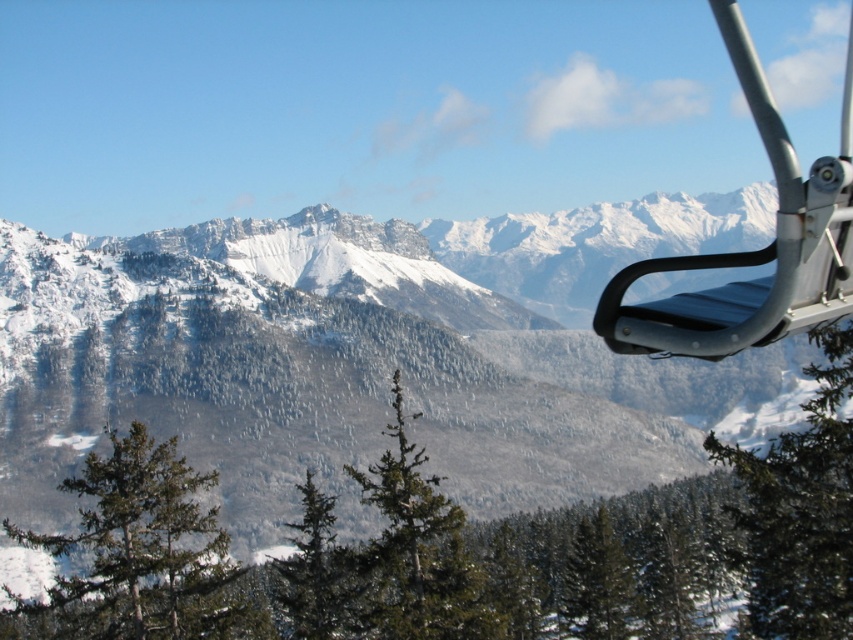
Identify the location of green matte tree at lower left. (136, 552).

Does green matte tree at lower left appear on the left side of green textured tree at center?

Indeed, green matte tree at lower left is positioned on the left side of green textured tree at center.

At what (x,y) coordinates should I click in order to perform the action: click on green matte tree at lower left. Please return your answer as a coordinate pair (x, y). Looking at the image, I should click on (136, 552).

You are a GUI agent. You are given a task and a screenshot of the screen. Output one action in this format:
    pyautogui.click(x=<x>, y=<y>)
    Task: Click on the green matte tree at lower left
    
    Given the screenshot: What is the action you would take?
    pyautogui.click(x=136, y=552)

Between metallic blue seat at upper right and green textured tree at center, which one has more height?

metallic blue seat at upper right

Can you confirm if metallic blue seat at upper right is positioned below green textured tree at center?

No, metallic blue seat at upper right is not below green textured tree at center.

Which is in front, point (798, 314) or point (386, 570)?

Positioned in front is point (798, 314).

Where is `metallic blue seat at upper right`? metallic blue seat at upper right is located at coordinates (757, 250).

Between green matte tree at lower left and metallic blue seat at upper right, which one appears on the right side from the viewer's perspective?

metallic blue seat at upper right is more to the right.

Find the location of a particular element. The width and height of the screenshot is (853, 640). green matte tree at lower left is located at coordinates (136, 552).

This screenshot has width=853, height=640. I want to click on green matte tree at lower left, so click(136, 552).